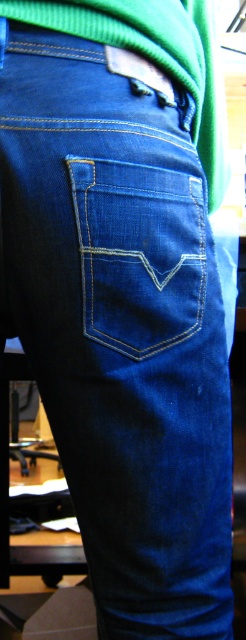
From the picture: You are a tailor trying to attach a decorative button to the denim blue jeans pocket at center and the green cotton sweater at upper center. Since you want the buttons to be proportional to each object, which object requires a smaller button?

The denim blue jeans pocket at center requires a smaller button because it has a smaller size compared to the green cotton sweater at upper center.

You are a fashion designer trying to replicate the exact placement of the denim blue jeans pocket at center. What are the coordinates of the pocket?

The coordinates of the denim blue jeans pocket at center are at point (139, 252).

In the scene shown: You are a tailor measuring the distance between the denim blue jeans pocket at center and the green cotton sweater at upper center for a custom alteration. The minimum required distance for the alteration is 6 inches. Can the alteration be done as planned?

The denim blue jeans pocket at center is 6.62 inches away from the green cotton sweater at upper center, which meets the minimum required distance of 6 inches. Therefore, the alteration can be done as planned.